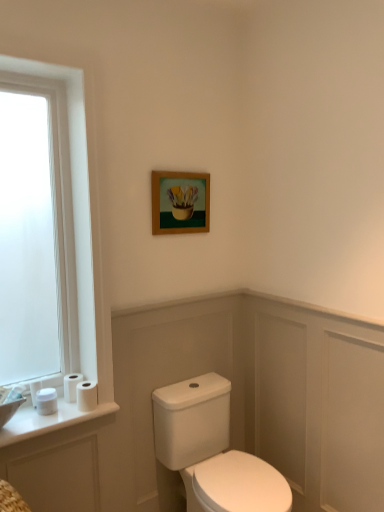
Question: Is white glossy porcelain at center looking in the opposite direction of white glossy sink at lower left?

Choices:
 (A) yes
 (B) no

Answer: (B)

Question: Does white glossy porcelain at center appear on the left side of white glossy sink at lower left?

Choices:
 (A) yes
 (B) no

Answer: (B)

Question: Is white glossy porcelain at center thinner than white glossy sink at lower left?

Choices:
 (A) no
 (B) yes

Answer: (A)

Question: Does white glossy porcelain at center have a larger size compared to white glossy sink at lower left?

Choices:
 (A) no
 (B) yes

Answer: (B)

Question: Can you confirm if white glossy porcelain at center is wider than white glossy sink at lower left?

Choices:
 (A) no
 (B) yes

Answer: (B)

Question: From the image's perspective, is white glossy porcelain at center located above white glossy sink at lower left?

Choices:
 (A) no
 (B) yes

Answer: (A)

Question: Is wooden frame at upper center to the left of white matte toilet paper at lower left, positioned as the first toilet paper in right-to-left order, from the viewer's perspective?

Choices:
 (A) yes
 (B) no

Answer: (B)

Question: Does wooden frame at upper center have a greater width compared to white matte toilet paper at lower left, acting as the 4th toilet paper starting from the left?

Choices:
 (A) yes
 (B) no

Answer: (B)

Question: Is there a large distance between wooden frame at upper center and white matte toilet paper at lower left, positioned as the first toilet paper in right-to-left order?

Choices:
 (A) yes
 (B) no

Answer: (B)

Question: Is wooden frame at upper center next to white matte toilet paper at lower left, acting as the 4th toilet paper starting from the left?

Choices:
 (A) no
 (B) yes

Answer: (A)

Question: Is wooden frame at upper center at the right side of white matte toilet paper at lower left, acting as the 4th toilet paper starting from the left?

Choices:
 (A) yes
 (B) no

Answer: (A)

Question: From the image's perspective, would you say wooden frame at upper center is shown under white matte toilet paper at lower left, acting as the 4th toilet paper starting from the left?

Choices:
 (A) no
 (B) yes

Answer: (A)

Question: Does wooden frame at upper center appear on the left side of white glossy porcelain at center?

Choices:
 (A) no
 (B) yes

Answer: (B)